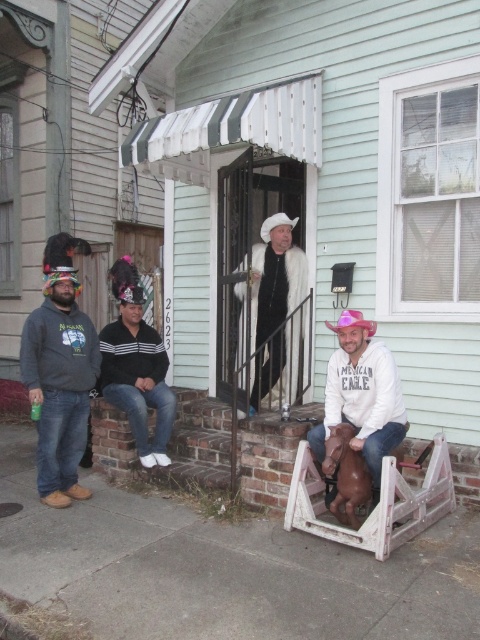
Based on the photo, you are standing on the porch of the light green house with white trim and want to hand a gift to the person wearing the matte gray hoodie at left. Based on their position coordinates, which direction should you move to approach them?

The matte gray hoodie at left is located at point coordinates, so you should move towards the left side of the porch to reach them.

You are standing on the porch of the house at 2623. You want to throw a ball to a friend who is standing at the point marked as point [67,317]. If your throwing range is 5 meters, will you be able to reach them?

The point [67,317] is 5.04 meters away from the viewer. Since your throwing range is 5 meters, you cannot reach them as the distance is slightly more than your range.

You are a photographer standing on the porch of the house at 2623. You want to take a photo of the matte gray hoodie at left and the black striped sweater at center. Since you can only focus on one person at a time, which person should you focus on first to ensure the other is still in the frame?

You should focus on the matte gray hoodie at left first because it is in front of the black striped sweater at center, so keeping the focus on the foreground subject ensures the background subject remains in the frame.